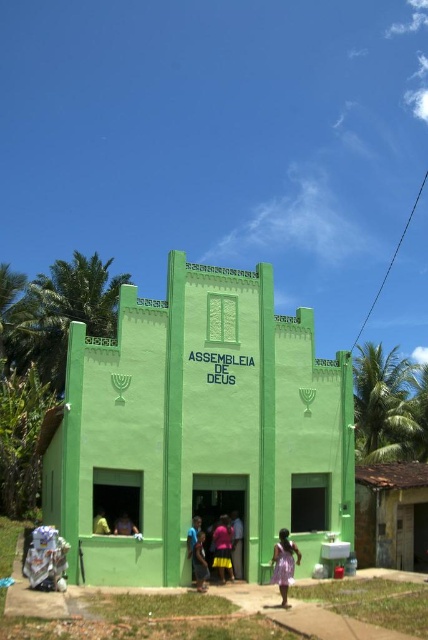
Question: Considering the relative positions of purple satin dress at lower center and blue fabric shirt at center in the image provided, where is purple satin dress at lower center located with respect to blue fabric shirt at center?

Choices:
 (A) right
 (B) left

Answer: (A)

Question: Which point is farther to the camera?

Choices:
 (A) (98, 529)
 (B) (214, 566)

Answer: (B)

Question: Considering the real-world distances, which object is farthest from the pink fabric at lower center?

Choices:
 (A) blue fabric shirt at center
 (B) yellow fabric at lower center
 (C) pink fabric skirt at center
 (D) purple satin dress at lower center

Answer: (B)

Question: Does blue fabric shirt at center appear over yellow fabric at lower left?

Choices:
 (A) no
 (B) yes

Answer: (A)

Question: Which object appears farthest from the camera in this image?

Choices:
 (A) pink fabric at lower center
 (B) yellow fabric at lower center
 (C) blue fabric shirt at center

Answer: (C)

Question: Is pink fabric at lower center above blue fabric shirt at center?

Choices:
 (A) yes
 (B) no

Answer: (B)